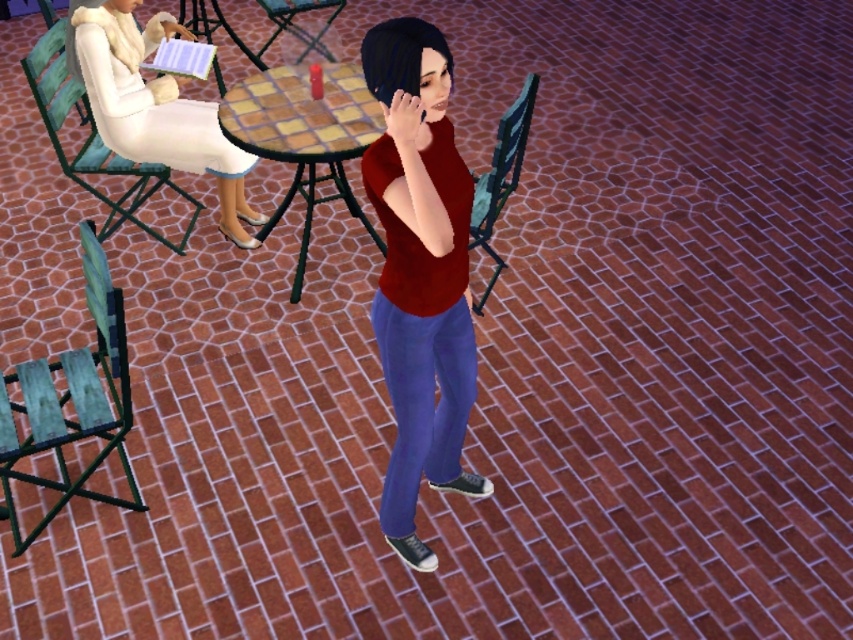
Question: Which is nearer to the green wood chair at upper left?

Choices:
 (A) green fabric chair at center
 (B) green fabric chair at right

Answer: (A)

Question: Does white fabric chair at upper left appear over green wood chair at upper left?

Choices:
 (A) no
 (B) yes

Answer: (A)

Question: Does white fabric chair at upper left have a smaller size compared to green fabric chair at center?

Choices:
 (A) yes
 (B) no

Answer: (B)

Question: From the image, what is the correct spatial relationship of matte red tank top at center in relation to green fabric chair at lower left?

Choices:
 (A) below
 (B) above

Answer: (B)

Question: Which of the following is the farthest from the observer?

Choices:
 (A) (433, 449)
 (B) (303, 29)

Answer: (B)

Question: Estimate the real-world distances between objects in this image. Which object is closer to the green fabric chair at lower left?

Choices:
 (A) checkerboard wood table at center
 (B) white fabric chair at upper left
 (C) green fabric chair at center

Answer: (A)